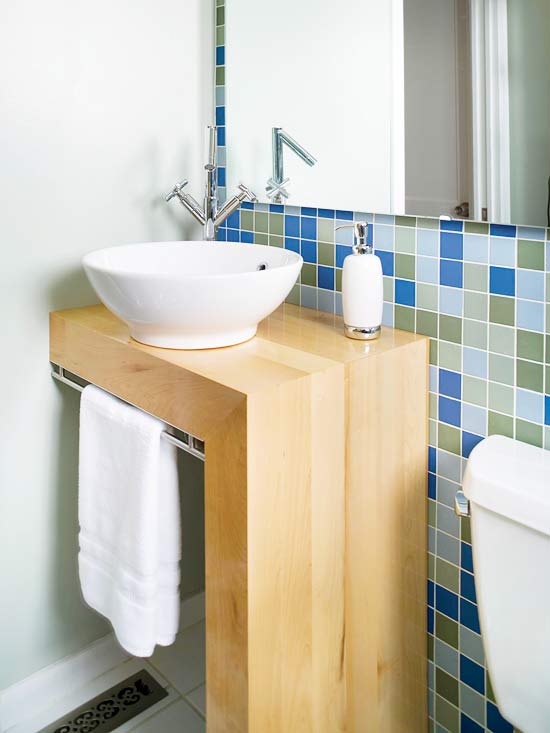
Locate an element on the screen. This screenshot has height=733, width=550. soap is located at coordinates click(x=363, y=320).